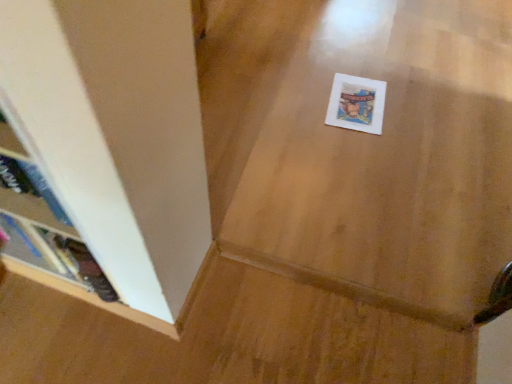
Locate an element on the screen. Image resolution: width=512 pixels, height=384 pixels. vacant area that is in front of white paper postcard at center is located at coordinates (362, 150).